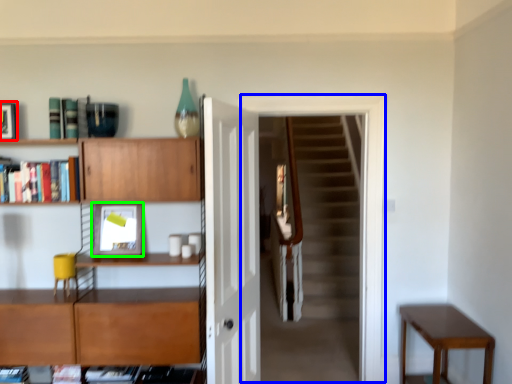
Question: Based on their relative distances, which object is nearer to picture frame (highlighted by a red box)? Choose from passage (highlighted by a blue box) and picture frame (highlighted by a green box).

Choices:
 (A) passage
 (B) picture frame

Answer: (B)